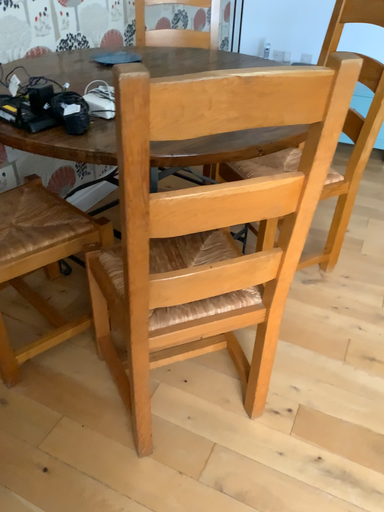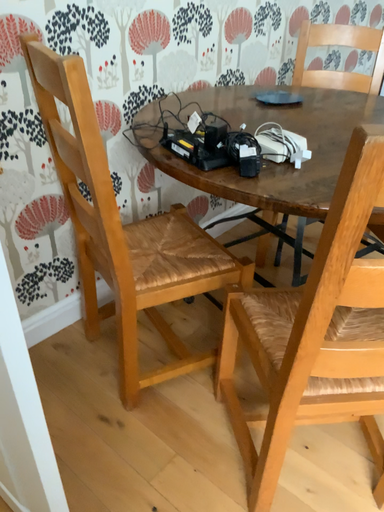
Question: How did the camera likely rotate when shooting the video?

Choices:
 (A) rotated right
 (B) rotated left

Answer: (B)